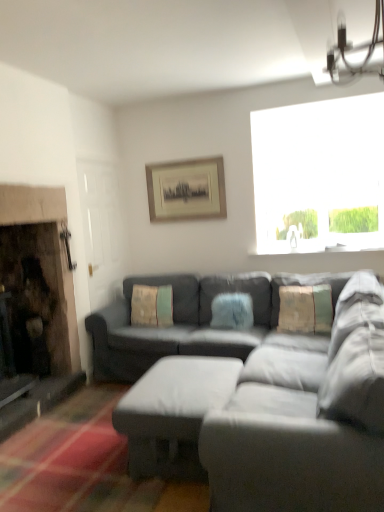
Question: Would you say textured beige pillow at center, arranged as the first pillow when viewed from the left, contains matte gray ottoman at center?

Choices:
 (A) no
 (B) yes

Answer: (A)

Question: From the image's perspective, is textured beige pillow at center, the 3th pillow positioned from the right, located above matte gray ottoman at center?

Choices:
 (A) yes
 (B) no

Answer: (A)

Question: Considering the relative positions of textured beige pillow at center, the 3th pillow positioned from the right, and matte gray ottoman at center in the image provided, is textured beige pillow at center, the 3th pillow positioned from the right, to the left of matte gray ottoman at center from the viewer's perspective?

Choices:
 (A) no
 (B) yes

Answer: (B)

Question: From the image's perspective, is textured beige pillow at center, arranged as the first pillow when viewed from the left, beneath matte gray ottoman at center?

Choices:
 (A) yes
 (B) no

Answer: (B)

Question: Is textured beige pillow at center, the 3th pillow positioned from the right, to the right of matte gray ottoman at center from the viewer's perspective?

Choices:
 (A) no
 (B) yes

Answer: (A)

Question: Is point (167, 382) positioned closer to the camera than point (246, 312)?

Choices:
 (A) farther
 (B) closer

Answer: (B)

Question: From the image's perspective, is matte gray ottoman at center located above or below fuzzy blue pillow at center, acting as the second pillow starting from the right?

Choices:
 (A) below
 (B) above

Answer: (A)

Question: From a real-world perspective, is matte gray ottoman at center physically located above or below fuzzy blue pillow at center, which is the second pillow in left-to-right order?

Choices:
 (A) below
 (B) above

Answer: (A)

Question: Is matte gray ottoman at center taller or shorter than fuzzy blue pillow at center, which is the second pillow in left-to-right order?

Choices:
 (A) tall
 (B) short

Answer: (A)

Question: Visually, is textured beige pillow at center, the 3th pillow positioned from the right, positioned to the left or to the right of fuzzy blue pillow at center, acting as the second pillow starting from the right?

Choices:
 (A) left
 (B) right

Answer: (A)

Question: In terms of height, does textured beige pillow at center, arranged as the first pillow when viewed from the left, look taller or shorter compared to fuzzy blue pillow at center, acting as the second pillow starting from the right?

Choices:
 (A) short
 (B) tall

Answer: (B)

Question: Is textured beige pillow at center, arranged as the first pillow when viewed from the left, situated inside fuzzy blue pillow at center, which is the second pillow in left-to-right order, or outside?

Choices:
 (A) outside
 (B) inside

Answer: (A)

Question: Considering the positions of textured beige pillow at center, the 3th pillow positioned from the right, and fuzzy blue pillow at center, which is the second pillow in left-to-right order, in the image, is textured beige pillow at center, the 3th pillow positioned from the right, bigger or smaller than fuzzy blue pillow at center, which is the second pillow in left-to-right order,?

Choices:
 (A) big
 (B) small

Answer: (A)

Question: Is matte gray couch at center in front of or behind white plastic light fixture at upper right in the image?

Choices:
 (A) behind
 (B) front

Answer: (B)

Question: Is matte gray couch at center to the left or to the right of white plastic light fixture at upper right in the image?

Choices:
 (A) right
 (B) left

Answer: (B)